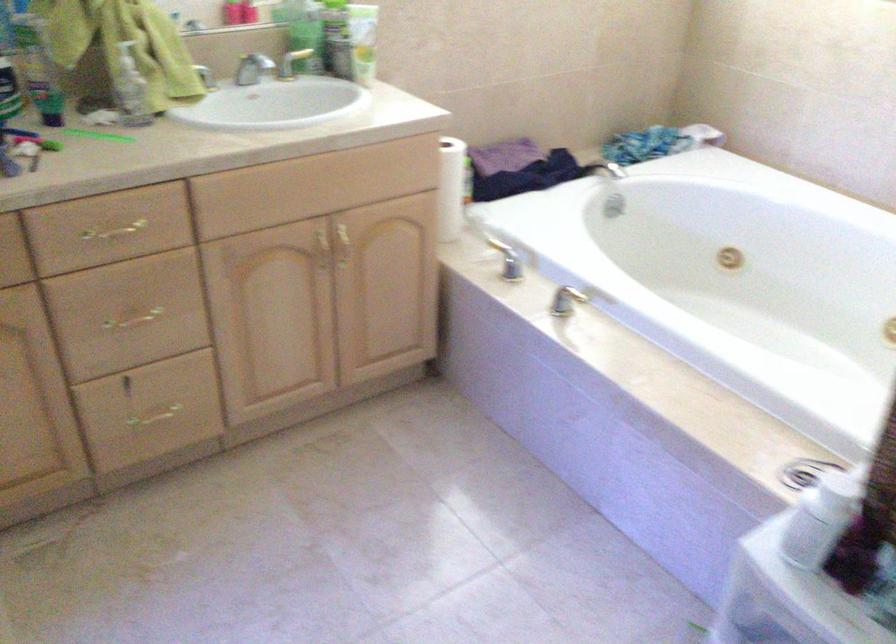
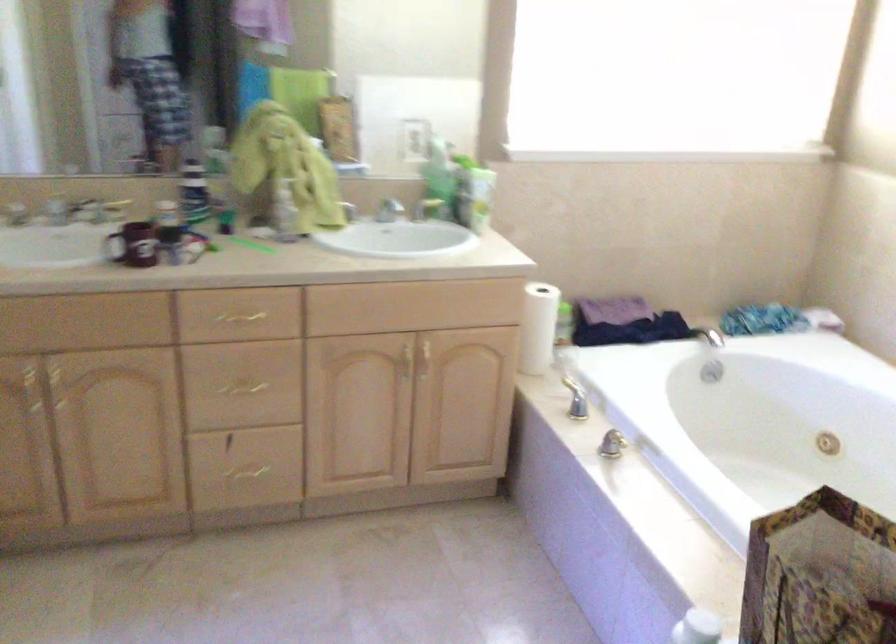
Find the pixel in the second image that matches pixel 341 245 in the first image.

(424, 359)